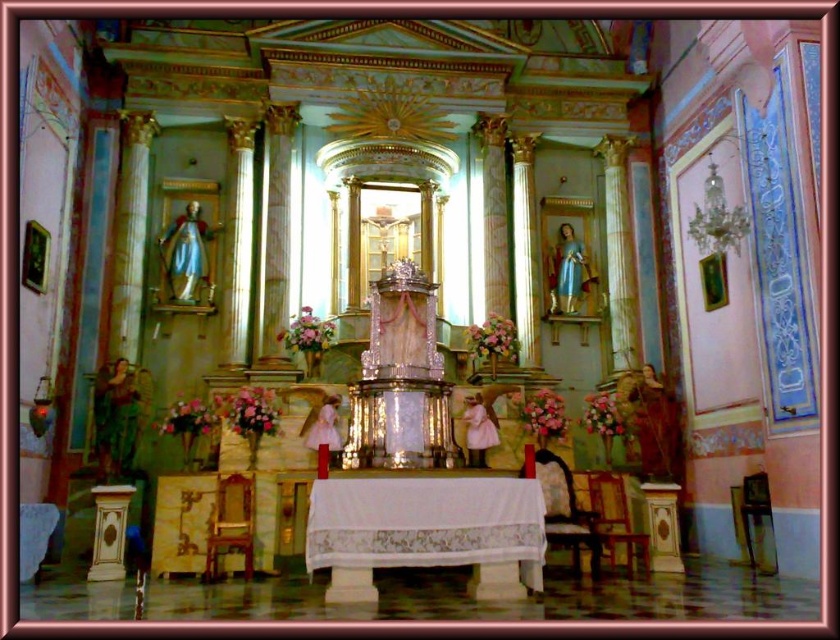
Question: Can you confirm if white cloth-covered table at center is wider than wooden upholstered chair at center?

Choices:
 (A) yes
 (B) no

Answer: (A)

Question: Can you confirm if wooden chair at lower left is wider than wooden chair at center?

Choices:
 (A) no
 (B) yes

Answer: (B)

Question: Which point is farther to the camera?

Choices:
 (A) (612, 492)
 (B) (247, 525)

Answer: (A)

Question: Which point is farther to the camera?

Choices:
 (A) wooden chair at lower left
 (B) wooden upholstered chair at center
 (C) wooden chair at center
 (D) white cloth-covered table at center

Answer: (C)

Question: Which of these objects is positioned closest to the wooden chair at lower left?

Choices:
 (A) white cloth-covered table at center
 (B) wooden chair at center

Answer: (A)

Question: Does wooden chair at lower left appear on the left side of wooden chair at center?

Choices:
 (A) yes
 (B) no

Answer: (A)